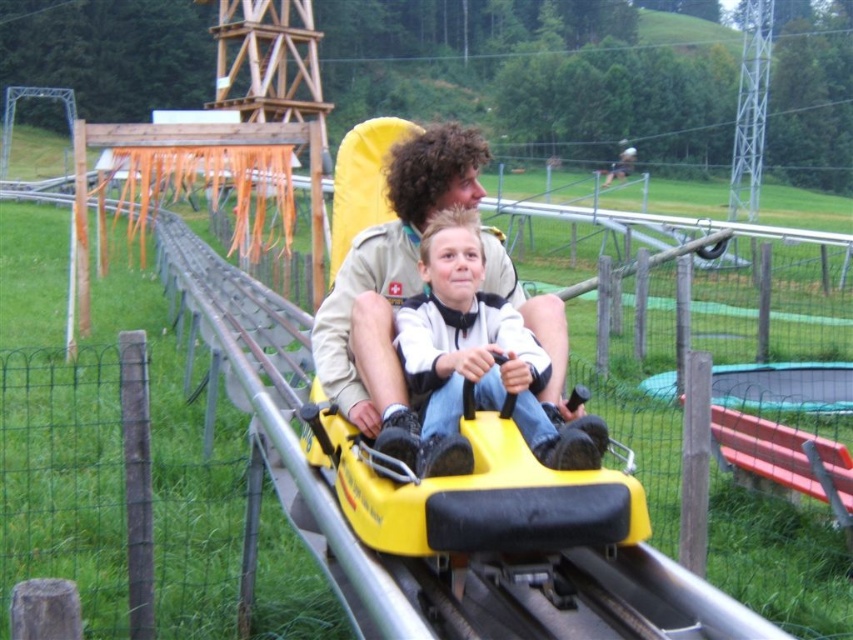
Is point (397, 301) behind point (526, 438)?

That is True.

Who is more distant from viewer, (531, 305) or (532, 429)?

The point (531, 305) is more distant.

Who is more distant from viewer, [432,141] or [410,321]?

The point [432,141] is more distant.

What are the coordinates of `khaki uniform at center` in the screenshot? It's located at (390, 276).